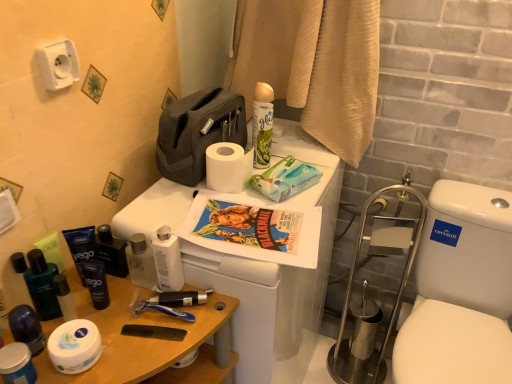
This screenshot has width=512, height=384. What are the coordinates of `free space in front of white matte lotion at center, the 1th toiletry when ordered from right to left` in the screenshot? It's located at (150, 340).